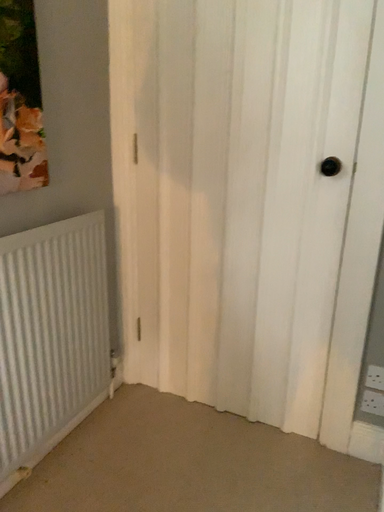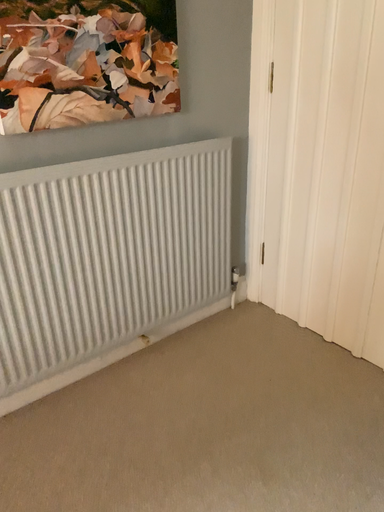
Question: Which way did the camera rotate in the video?

Choices:
 (A) rotated right
 (B) rotated left

Answer: (B)